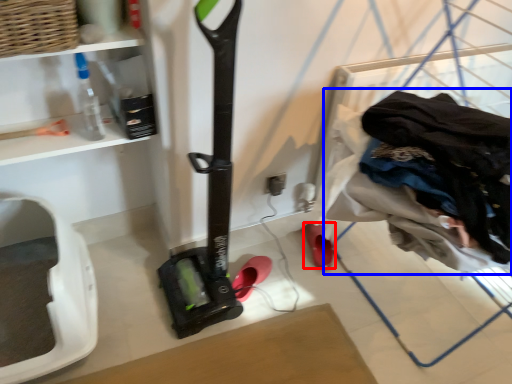
Question: Which object is further to the camera taking this photo, footwear (highlighted by a red box) or clothing (highlighted by a blue box)?

Choices:
 (A) footwear
 (B) clothing

Answer: (A)